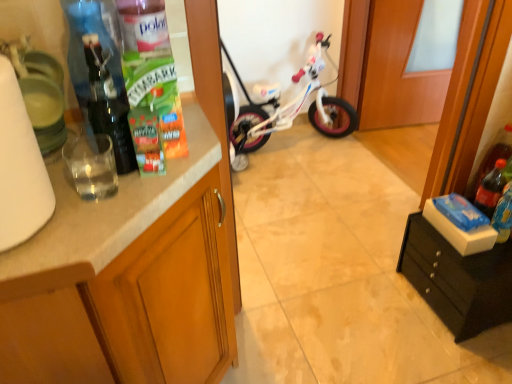
Question: From the image's perspective, is matte wood cabinet at left, which ranks as the first cabinetry in left-to-right order, located above clear plastic bottle at upper left, positioned as the 1th bottle in front-to-back order?

Choices:
 (A) yes
 (B) no

Answer: (B)

Question: Can you confirm if matte wood cabinet at left, the second cabinetry in the right-to-left sequence, is shorter than clear plastic bottle at upper left, the 3th bottle viewed from the right?

Choices:
 (A) no
 (B) yes

Answer: (A)

Question: Does matte wood cabinet at left, which ranks as the first cabinetry in left-to-right order, have a greater height compared to clear plastic bottle at upper left, the 3th bottle viewed from the right?

Choices:
 (A) yes
 (B) no

Answer: (A)

Question: Can you confirm if matte wood cabinet at left, which ranks as the first cabinetry in left-to-right order, is smaller than clear plastic bottle at upper left, which is counted as the third bottle, starting from the back?

Choices:
 (A) no
 (B) yes

Answer: (A)

Question: Considering the relative sizes of matte wood cabinet at left, the second cabinetry in the right-to-left sequence, and clear plastic bottle at upper left, which is counted as the first bottle, starting from the left, in the image provided, is matte wood cabinet at left, the second cabinetry in the right-to-left sequence, thinner than clear plastic bottle at upper left, which is counted as the first bottle, starting from the left,?

Choices:
 (A) no
 (B) yes

Answer: (A)

Question: Could you tell me if matte wood cabinet at left, which ranks as the first cabinetry in left-to-right order, is facing clear plastic bottle at upper left, which is counted as the third bottle, starting from the back?

Choices:
 (A) no
 (B) yes

Answer: (A)

Question: From the image's perspective, is white marble countertop at left located beneath white glossy bicycle at center?

Choices:
 (A) no
 (B) yes

Answer: (B)

Question: From a real-world perspective, is white marble countertop at left on top of white glossy bicycle at center?

Choices:
 (A) yes
 (B) no

Answer: (A)

Question: Is the position of white marble countertop at left more distant than that of white glossy bicycle at center?

Choices:
 (A) no
 (B) yes

Answer: (A)

Question: Does white marble countertop at left appear on the left side of white glossy bicycle at center?

Choices:
 (A) no
 (B) yes

Answer: (B)

Question: Does white marble countertop at left have a lesser height compared to white glossy bicycle at center?

Choices:
 (A) yes
 (B) no

Answer: (A)

Question: Is white marble countertop at left turned away from white glossy bicycle at center?

Choices:
 (A) no
 (B) yes

Answer: (A)

Question: Is matte wood cabinet at left, the second cabinetry in the right-to-left sequence, located within white glossy bicycle at center?

Choices:
 (A) yes
 (B) no

Answer: (B)